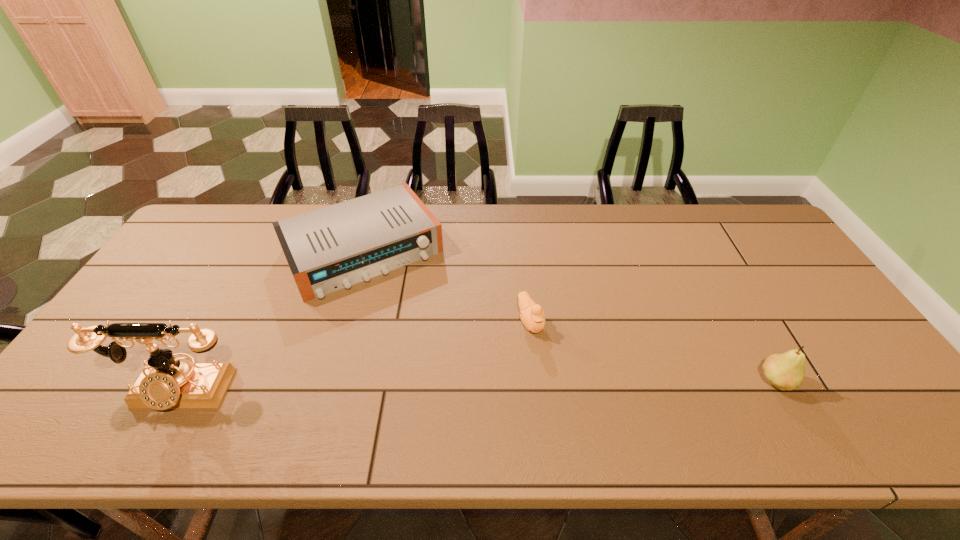
The width and height of the screenshot is (960, 540). What are the coordinates of `vacant region located 0.190m on the face of the third nearest object` in the screenshot? It's located at (569, 399).

Where is `free space located 0.120m on the face of the third nearest object`? Image resolution: width=960 pixels, height=540 pixels. free space located 0.120m on the face of the third nearest object is located at coordinates (556, 375).

The image size is (960, 540). Find the location of `free spot located 0.150m on the face of the third nearest object`. free spot located 0.150m on the face of the third nearest object is located at coordinates (562, 385).

The image size is (960, 540). Identify the location of object present at the far edge. tap(334, 247).

Where is `telephone located at the near edge`? telephone located at the near edge is located at coordinates (165, 382).

The width and height of the screenshot is (960, 540). What are the coordinates of `pear that is at the near edge` in the screenshot? It's located at (785, 371).

Where is `object at the left edge`? object at the left edge is located at coordinates (165, 382).

Identify the location of object at the near left corner. (165, 382).

This screenshot has width=960, height=540. I want to click on blank space at the far edge of the desktop, so click(x=478, y=213).

Image resolution: width=960 pixels, height=540 pixels. Find the location of `free space at the near edge of the desktop`. free space at the near edge of the desktop is located at coordinates (749, 395).